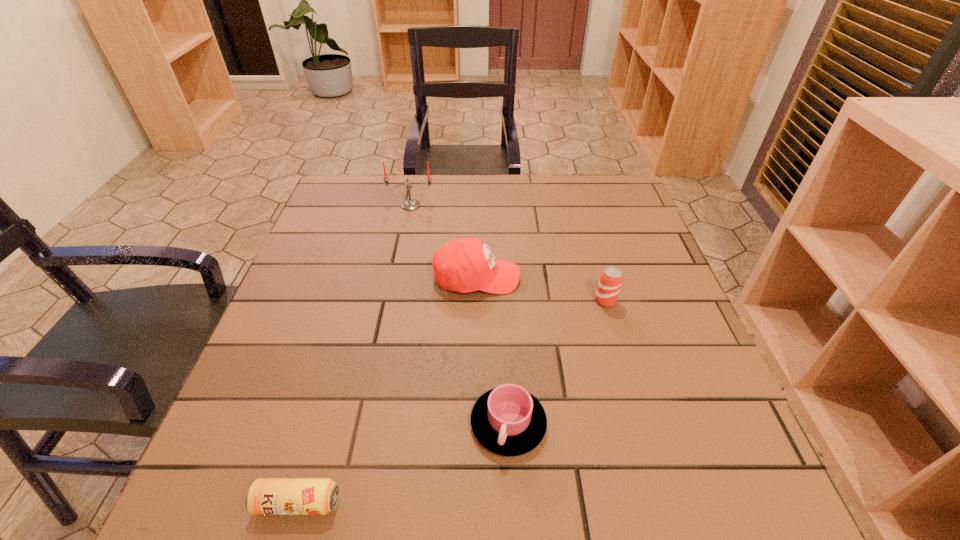
Find the location of a particular element. The height and width of the screenshot is (540, 960). vacant space situated 0.080m on the front panel of the baseball cap is located at coordinates (553, 278).

Identify the location of vacant area situated 0.270m on the front of the right beer can. The width and height of the screenshot is (960, 540). point(640,420).

Find the location of a particular element. vacant space situated on the side with the handle of the fourth tallest object is located at coordinates (513, 520).

In order to click on free region located 0.330m on the right of the shorter beer can in this screenshot , I will do `click(553, 503)`.

Locate an element on the screen. Image resolution: width=960 pixels, height=540 pixels. object that is positioned at the far edge is located at coordinates (410, 204).

Find the location of a particular element. The height and width of the screenshot is (540, 960). object that is at the near edge is located at coordinates (266, 496).

Identify the location of object at the left edge. click(266, 496).

Where is `object that is positioned at the right edge`? This screenshot has width=960, height=540. object that is positioned at the right edge is located at coordinates (611, 278).

You are a GUI agent. You are given a task and a screenshot of the screen. Output one action in this format:
    pyautogui.click(x=<x>, y=<y>)
    Task: Click on the object at the near left corner
    
    Given the screenshot: What is the action you would take?
    pyautogui.click(x=266, y=496)

Locate an element on the screen. The height and width of the screenshot is (540, 960). blank area at the far edge is located at coordinates (406, 176).